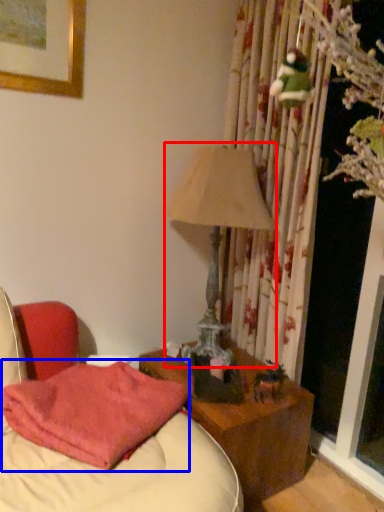
Question: Which object is closer to the camera taking this photo, table lamp (highlighted by a red box) or pillow (highlighted by a blue box)?

Choices:
 (A) table lamp
 (B) pillow

Answer: (B)